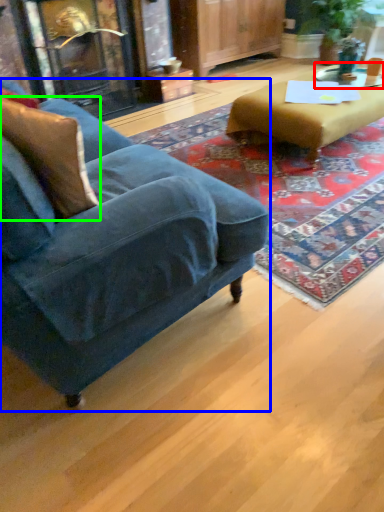
Question: Based on their relative distances, which object is nearer to side table (highlighted by a red box)? Choose from studio couch (highlighted by a blue box) and pillow (highlighted by a green box).

Choices:
 (A) studio couch
 (B) pillow

Answer: (A)